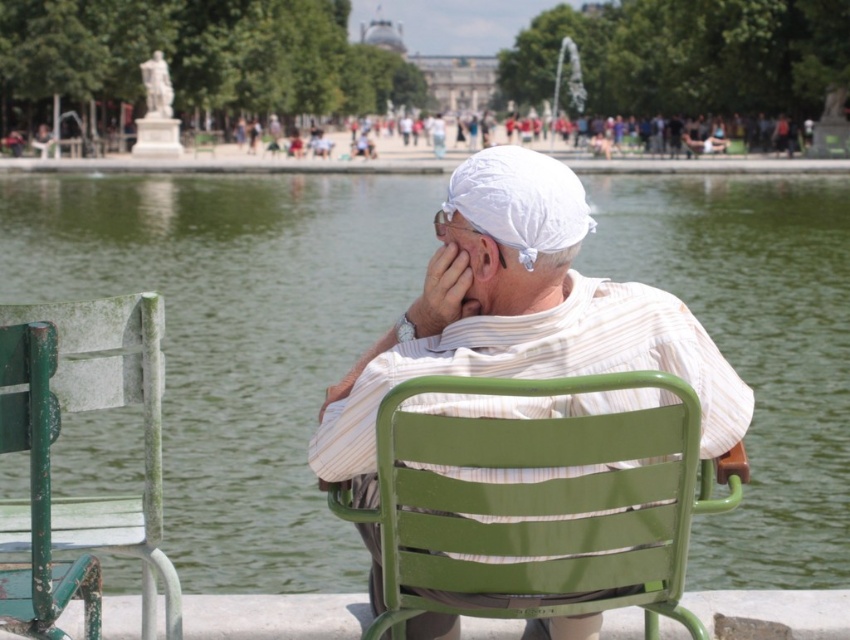
You are planning to place a new bench next to the green weathered wood chair at left and the green metal lake at center. Which object should the bench be placed closer to in order to ensure it fits better with the existing space?

The bench should be placed closer to the green metal lake at center because its width is greater than the green weathered wood chair at left, allowing for better spatial compatibility.

You are a visitor at the lake and want to place a 100 feet long floating dock between the green metal lake at center and the white cotton turban at center. Is there enough space to place the dock between them?

The distance between the green metal lake at center and the white cotton turban at center is 113.54 feet, which is greater than the 100 feet length of the dock. Therefore, there is enough space to place the dock between them.

You are standing at the point marked by the coordinates point (235, 337) in the image. What object is located exactly at this point?

The point (235, 337) marks the green metal lake at center.